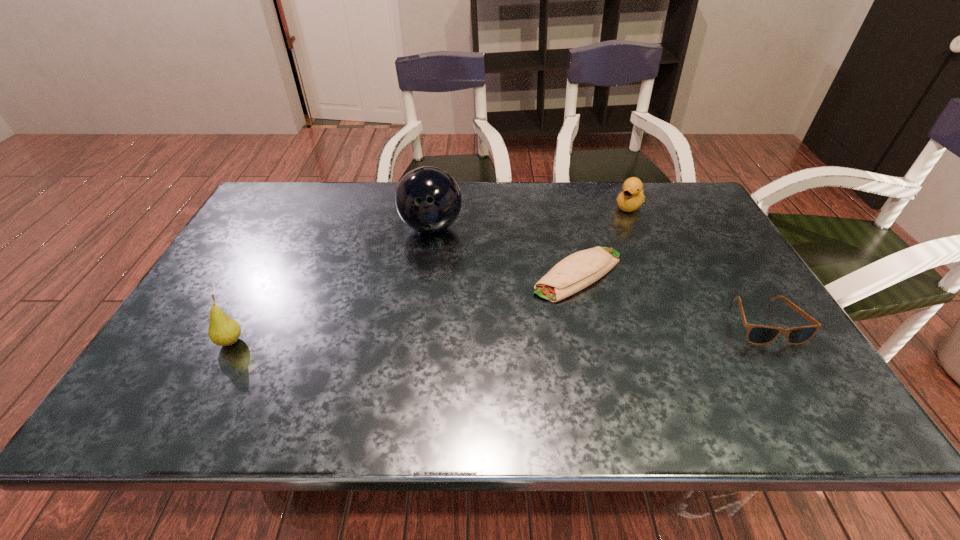
The image size is (960, 540). Identify the location of blank area located at the bitten end of the burrito. (445, 353).

You are a GUI agent. You are given a task and a screenshot of the screen. Output one action in this format:
    pyautogui.click(x=<x>, y=<y>)
    Task: Click on the bowling ball that is positioned at the far edge
    
    Given the screenshot: What is the action you would take?
    tap(428, 199)

Identify the location of duckling positioned at the far edge. (632, 197).

Identify the location of object that is at the near edge. (223, 331).

Find the location of `object located in the left edge section of the desktop`. object located in the left edge section of the desktop is located at coordinates (223, 331).

Where is `object at the right edge`? The height and width of the screenshot is (540, 960). object at the right edge is located at coordinates tap(756, 334).

Find the location of `object at the near left corner`. object at the near left corner is located at coordinates (223, 331).

In the image, there is a desktop. Where is `blank space at the far edge`? Image resolution: width=960 pixels, height=540 pixels. blank space at the far edge is located at coordinates [607, 191].

Where is `vacant position at the near edge of the desktop`? The image size is (960, 540). vacant position at the near edge of the desktop is located at coordinates (489, 350).

Where is `vacant area at the left edge of the desktop`? The height and width of the screenshot is (540, 960). vacant area at the left edge of the desktop is located at coordinates click(266, 247).